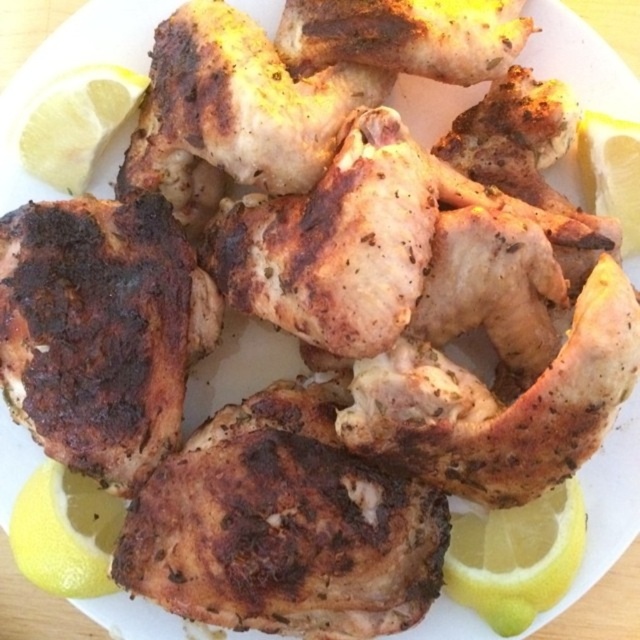
You are a food photographer and need to adjust the lighting so that the yellow matte lemon at lower left is illuminated. The light source is currently positioned 1.20 meters away from the lemon. Is the light source closer to the lemon or farther away compared to the recommended distance of 1 meter for optimal lighting?

The light source is positioned 1.20 meters away from the yellow matte lemon at lower left, which is farther than the recommended 1 meter distance for optimal lighting. To achieve better illumination, move the light source closer to the lemon.

Based on the photo, you are a food stylist arranging a photo shoot. You have two yellow matte lemons on the plate. Where should you place the next lemon slice to maintain symmetry between the yellow matte lemon at lower left and the yellow matte lemon at upper left?

To maintain symmetry between the yellow matte lemon at lower left and the yellow matte lemon at upper left, you should place the next lemon slice at the lower right position, mirroring the existing lemon at upper left.